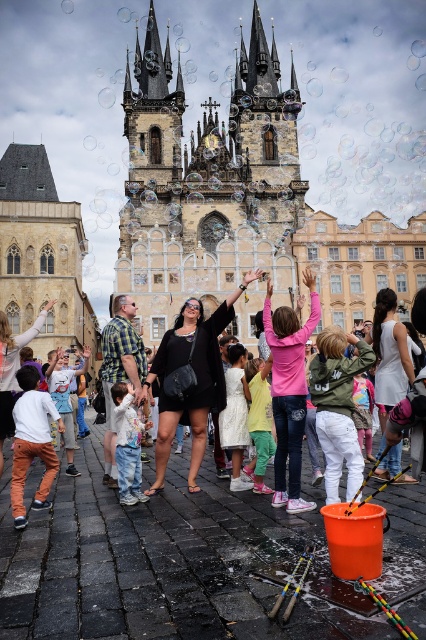
Question: Which object is the farthest from the green matte jacket at center?

Choices:
 (A) pink matte shirt at center
 (B) denim jeans at center
 (C) white matte dress at center
 (D) checkered fabric shirt at center

Answer: (D)

Question: Which object appears farthest from the camera in this image?

Choices:
 (A) white matte dress at center
 (B) stone gothic tower at center
 (C) denim jeans at center
 (D) green matte jacket at center

Answer: (B)

Question: Is black matte dress at center thinner than white cotton shirt at lower left?

Choices:
 (A) no
 (B) yes

Answer: (A)

Question: Which object is closer to the camera taking this photo?

Choices:
 (A) black matte dress at center
 (B) green matte jacket at center
 (C) white cotton shirt at lower left
 (D) checkered fabric shirt at center

Answer: (B)

Question: Does black matte dress at center have a larger size compared to checkered fabric shirt at center?

Choices:
 (A) no
 (B) yes

Answer: (B)

Question: Is white matte dress at center to the left of light pink fabric dress at center from the viewer's perspective?

Choices:
 (A) no
 (B) yes

Answer: (A)